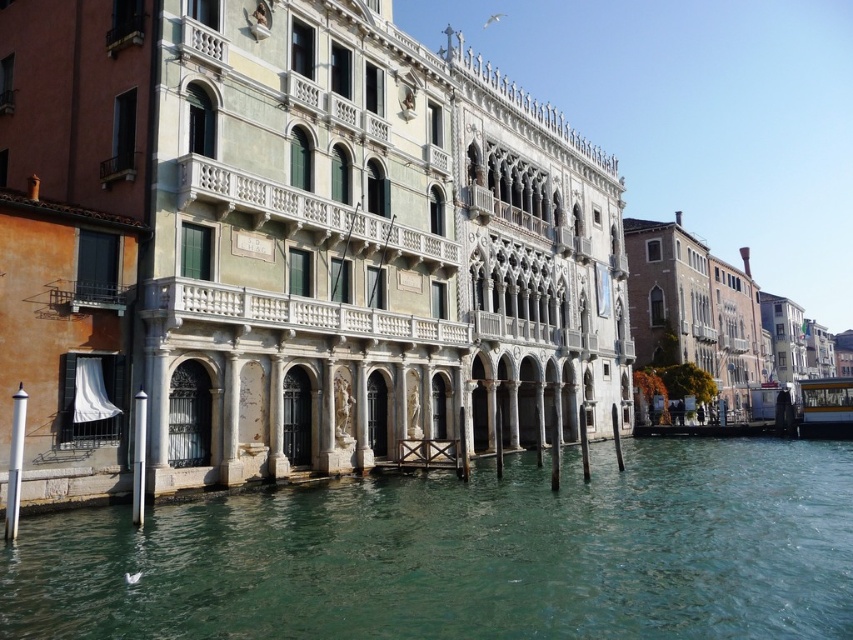
What do you see at coordinates (468, 554) in the screenshot? Image resolution: width=853 pixels, height=640 pixels. I see `greenish water at lower center` at bounding box center [468, 554].

Is point (473, 614) behind point (804, 420)?

That is False.

Is point (636, 632) closer to camera compared to point (805, 435)?

Yes, point (636, 632) is in front of point (805, 435).

At what (x,y) coordinates should I click in order to perform the action: click on greenish water at lower center. Please return your answer as a coordinate pair (x, y). The height and width of the screenshot is (640, 853). Looking at the image, I should click on click(x=468, y=554).

Can you confirm if white marble palace at center is positioned below greenish water at lower center?

Incorrect, white marble palace at center is not positioned below greenish water at lower center.

Which is more to the left, white marble palace at center or greenish water at lower center?

white marble palace at center is more to the left.

Between point (120, 147) and point (811, 465), which one is positioned behind?

Positioned behind is point (811, 465).

This screenshot has height=640, width=853. Find the location of `white marble palace at center`. white marble palace at center is located at coordinates tap(289, 248).

Is point (1, 81) farther from camera compared to point (778, 397)?

No, it is in front of (778, 397).

Identify the location of white marble palace at center. (289, 248).